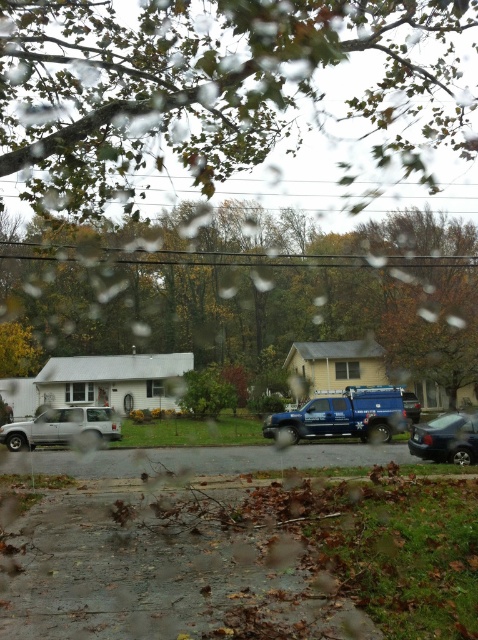
You are a delivery person needing to deliver a package to the house with the silver metallic suv at left. The green leafy tree at upper center is blocking your path. Can you estimate if you can drive around it without hitting the tree?

The distance between the green leafy tree at upper center and the silver metallic suv at left is 17.70 meters. Since the tree is blocking the path, you would need to maneuver around it. However, the distance provided does not specify the width of the driveway or the space available to navigate around the tree. Without information on the driveway width or the tree trunk size, it is difficult to accurately estimate if driving around it is feasible. Please check the actual space available or consider an alter

You are standing inside a house looking out through the window. You see a green leafy tree at center and a blue metallic truck at center. Which object is closer to the window?

The green leafy tree at center is above the blue metallic truck at center, meaning it is closer to the window.

You are standing in front of the window and notice two points on the glass. The first point is at coordinate point (468, 234) and the second is at point (391, 413). Which point is closer to you?

Point (468, 234) is closer to you than point (391, 413) because it is further to the viewer.